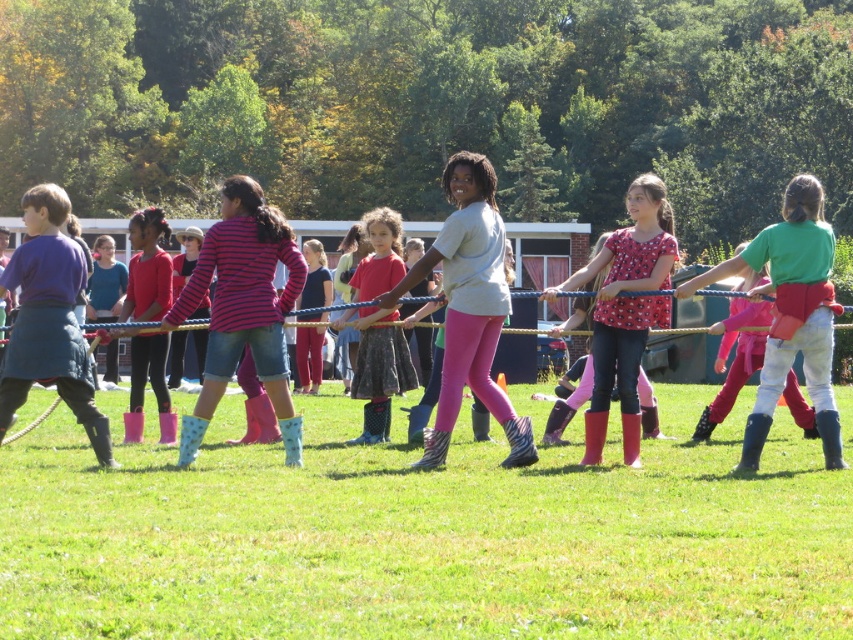
Is pink zebra-patterned leggings at center below green fabric shirt at center?

No.

Is pink zebra-patterned leggings at center positioned before green fabric shirt at center?

Yes.

Does point (503, 237) lie behind point (717, 364)?

No, it is not.

Find the location of a particular element. The width and height of the screenshot is (853, 640). pink zebra-patterned leggings at center is located at coordinates (469, 307).

Is point (631, 282) closer to camera compared to point (148, 280)?

Yes, it is in front of point (148, 280).

Can you confirm if red matte leggings at center is thinner than pink rubber boots at center?

Correct, red matte leggings at center's width is less than pink rubber boots at center's.

Describe the element at coordinates (625, 310) in the screenshot. The height and width of the screenshot is (640, 853). I see `red matte leggings at center` at that location.

I want to click on red matte leggings at center, so click(625, 310).

Which is in front, point (54, 300) or point (132, 417)?

Positioned in front is point (54, 300).

Is matte purple jacket at left positioned in front of pink rubber boots at center?

That is True.

Is point (82, 262) in front of point (158, 412)?

Yes, it is.

The image size is (853, 640). I want to click on matte purple jacket at left, so pyautogui.click(x=49, y=320).